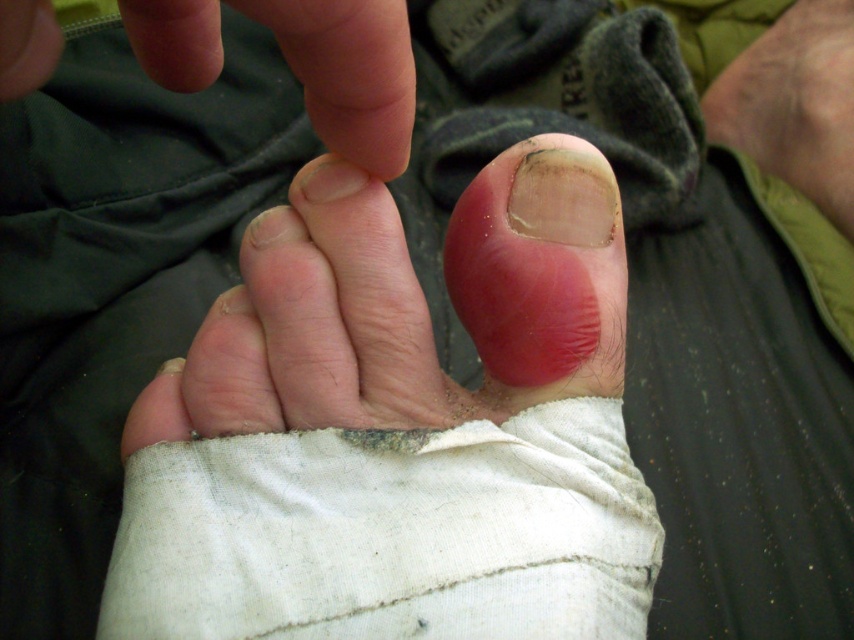
You are a medical professional examining a patient. You observe a point at coordinates (407, 305) on the image. Based on the scene, what anatomical structure does this point correspond to?

The point at coordinates (407, 305) corresponds to the pink flesh toned toe at center.